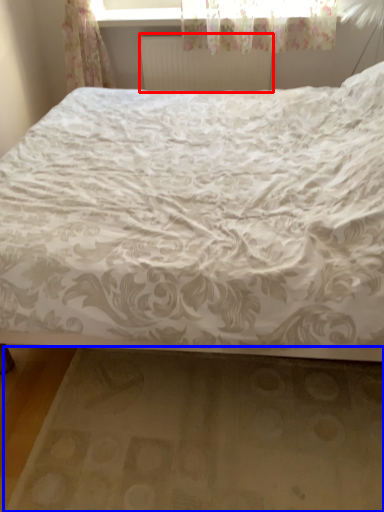
Question: Which of the following is the farthest to the observer, radiator (highlighted by a red box) or bed frame (highlighted by a blue box)?

Choices:
 (A) radiator
 (B) bed frame

Answer: (A)